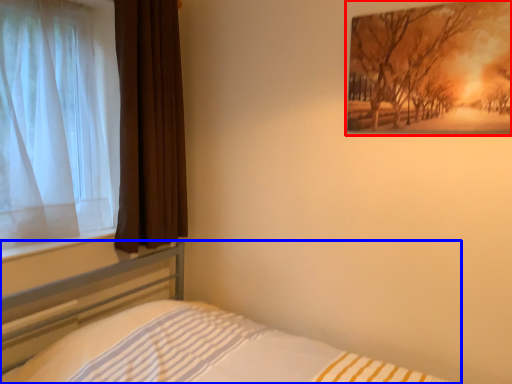
Question: Among these objects, which one is nearest to the camera, picture frame (highlighted by a red box) or bed (highlighted by a blue box)?

Choices:
 (A) picture frame
 (B) bed

Answer: (B)